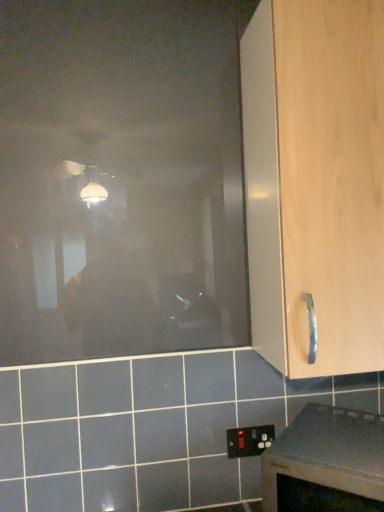
Question: Looking at their shapes, would you say smooth gray countertop at lower right is wider or thinner than light wood cabinet handle at right?

Choices:
 (A) thin
 (B) wide

Answer: (B)

Question: From a real-world perspective, is smooth gray countertop at lower right above or below light wood cabinet handle at right?

Choices:
 (A) below
 (B) above

Answer: (A)

Question: Estimate the real-world distances between objects in this image. Which object is closer to the transparent matte glass door at upper left?

Choices:
 (A) smooth gray countertop at lower right
 (B) black plastic electric outlet at lower center
 (C) light wood cabinet handle at right

Answer: (C)

Question: Estimate the real-world distances between objects in this image. Which object is closer to the black plastic electric outlet at lower center?

Choices:
 (A) transparent matte glass door at upper left
 (B) light wood cabinet handle at right
 (C) smooth gray countertop at lower right

Answer: (C)